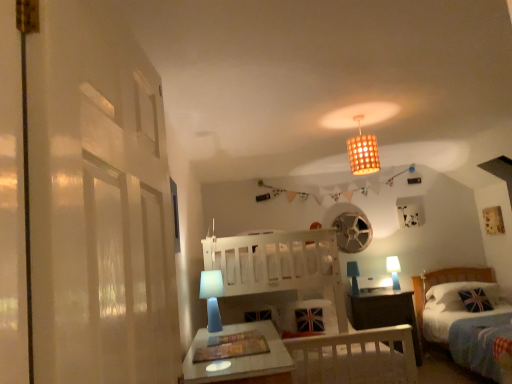
Question: Is blue fabric lampshade at lower center, placed as the 3th table lamp when sorted from back to front, bigger or smaller than white wooden bunk bed at center?

Choices:
 (A) big
 (B) small

Answer: (B)

Question: Looking at their shapes, would you say blue fabric lampshade at lower center, the third table lamp positioned from the right, is wider or thinner than white wooden bunk bed at center?

Choices:
 (A) wide
 (B) thin

Answer: (B)

Question: Considering the real-world distances, which object is farthest from the white wooden bunk bed at center?

Choices:
 (A) blue fabric table lamp at center, which appears as the 2th table lamp when viewed from the front
 (B) dark wood nightstand at lower right
 (C) union jack fabric pillow at lower right
 (D) blue matte table lamp at right, positioned as the 1th table lamp in right-to-left order
 (E) bamboo woven lampshade at upper center

Answer: (D)

Question: Based on their relative distances, which object is nearer to the blue matte table lamp at right, positioned as the 1th table lamp in right-to-left order?

Choices:
 (A) union jack fabric pillow at lower right
 (B) dark wood nightstand at lower right
 (C) blue fabric lampshade at lower center, placed as the 3th table lamp when sorted from back to front
 (D) white wooden bunk bed at center
 (E) bamboo woven lampshade at upper center

Answer: (B)